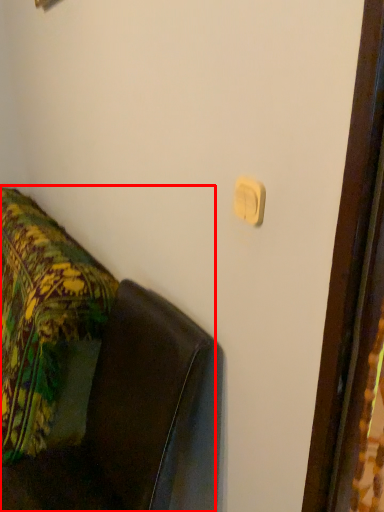
Question: From the image's perspective, where is furniture (annotated by the red box) located in relation to light switch in the image?

Choices:
 (A) above
 (B) below

Answer: (B)